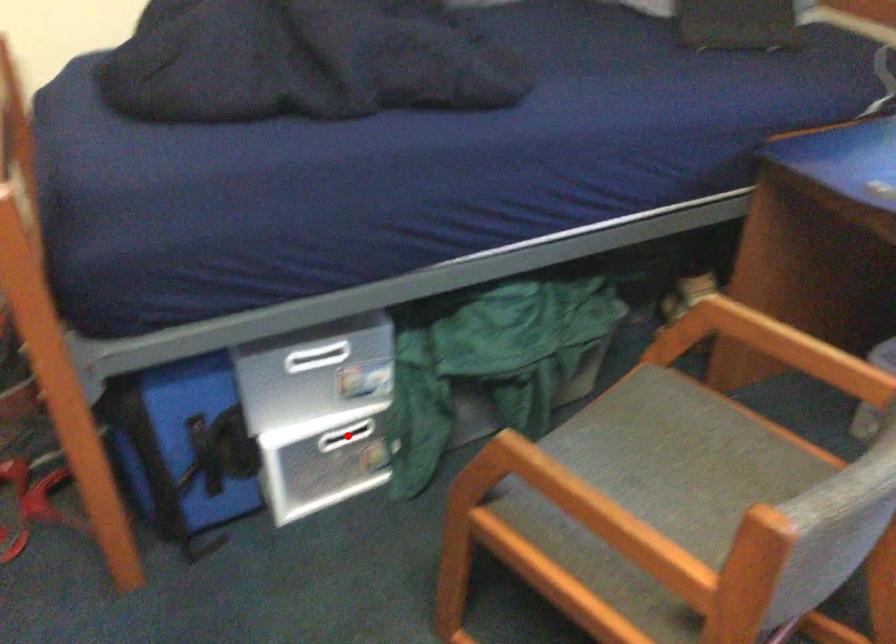
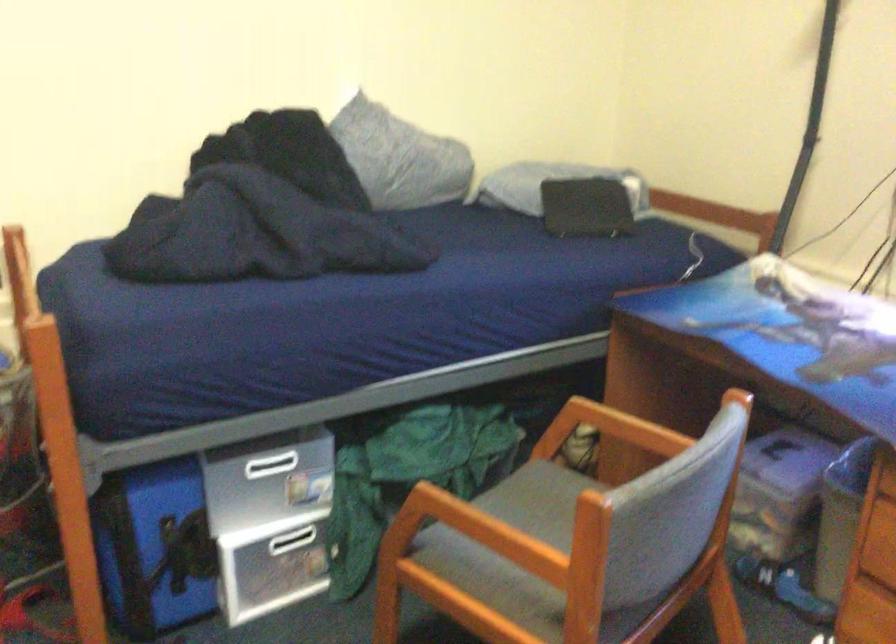
Question: I am providing you with two images of the same scene from different viewpoints. A red point is marked on the first image. At the location where the point appears in image 1, is it still visible in image 2?

Choices:
 (A) Yes
 (B) No

Answer: (A)